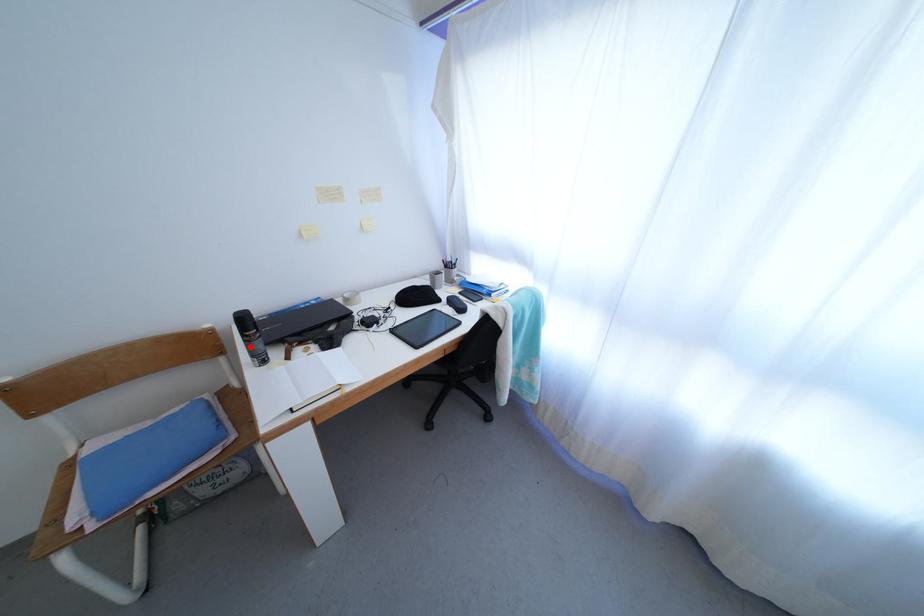
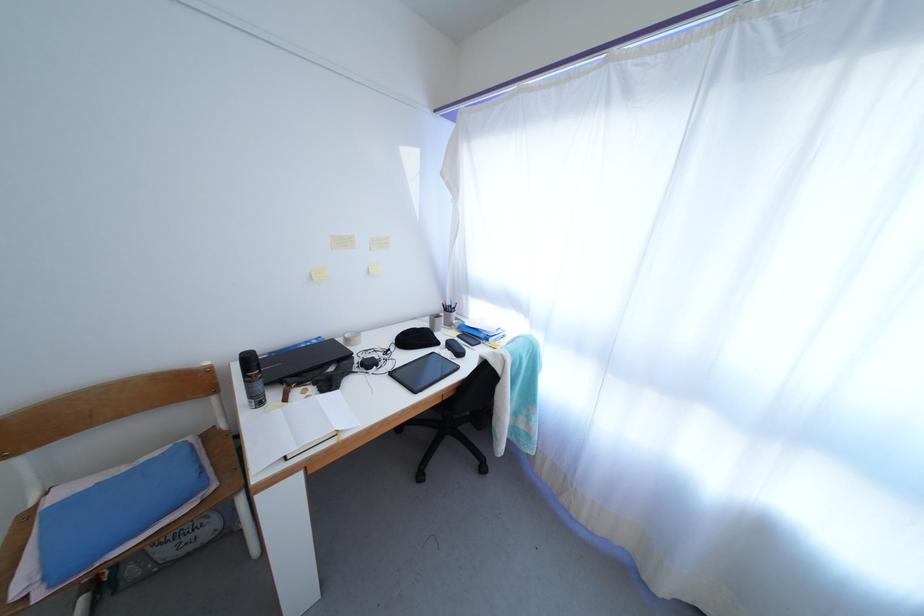
Where in the second image is the point corresponding to the highlighted location from the first image?

(250, 387)